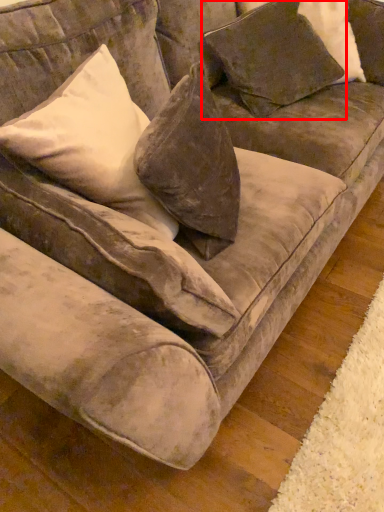
Question: From the image's perspective, considering the relative positions of pillow (annotated by the red box) and pillow in the image provided, where is pillow (annotated by the red box) located with respect to the staircase?

Choices:
 (A) below
 (B) above

Answer: (B)